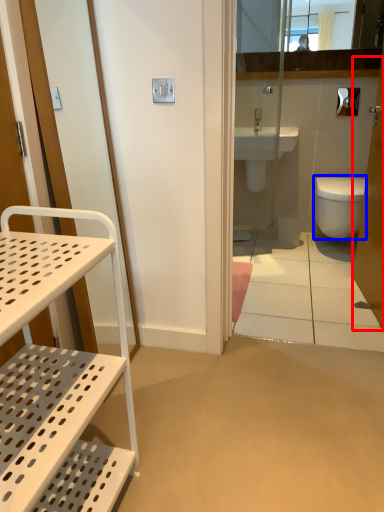
Question: Which point is closer to the camera, screen door (highlighted by a red box) or bidet (highlighted by a blue box)?

Choices:
 (A) screen door
 (B) bidet

Answer: (A)